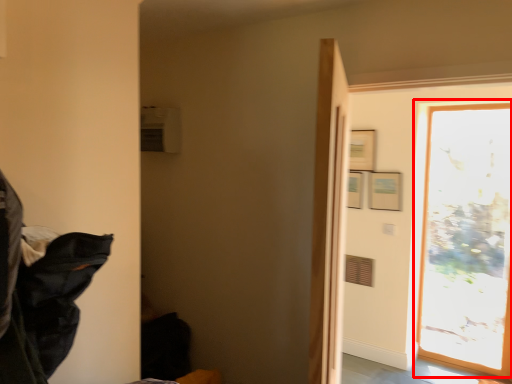
Question: Considering the relative positions of window (annotated by the red box) and laundry in the image provided, where is window (annotated by the red box) located with respect to the staircase?

Choices:
 (A) right
 (B) left

Answer: (A)